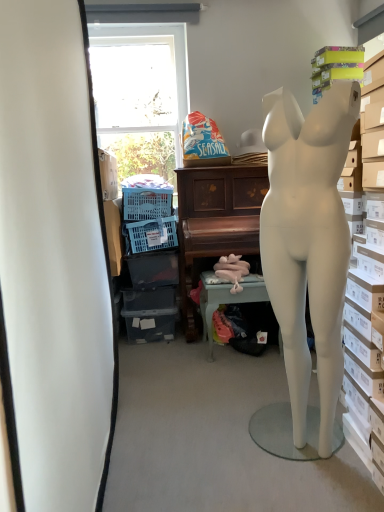
Question: Is wooden piano at center wider than pink fabric-covered table at center?

Choices:
 (A) yes
 (B) no

Answer: (A)

Question: Is wooden piano at center thinner than pink fabric-covered table at center?

Choices:
 (A) yes
 (B) no

Answer: (B)

Question: Does wooden piano at center have a lesser height compared to pink fabric-covered table at center?

Choices:
 (A) yes
 (B) no

Answer: (B)

Question: From the image's perspective, would you say wooden piano at center is shown under pink fabric-covered table at center?

Choices:
 (A) no
 (B) yes

Answer: (A)

Question: Is wooden piano at center positioned with its back to pink fabric-covered table at center?

Choices:
 (A) no
 (B) yes

Answer: (A)

Question: From a real-world perspective, is wooden piano at center positioned over pink fabric-covered table at center based on gravity?

Choices:
 (A) no
 (B) yes

Answer: (B)

Question: Does blue plastic laundry basket at lower left come behind pink fabric-covered table at center?

Choices:
 (A) yes
 (B) no

Answer: (A)

Question: Is blue plastic laundry basket at lower left bigger than pink fabric-covered table at center?

Choices:
 (A) yes
 (B) no

Answer: (B)

Question: Is blue plastic laundry basket at lower left taller than pink fabric-covered table at center?

Choices:
 (A) no
 (B) yes

Answer: (A)

Question: From the image's perspective, is blue plastic laundry basket at lower left on top of pink fabric-covered table at center?

Choices:
 (A) yes
 (B) no

Answer: (A)

Question: From a real-world perspective, does blue plastic laundry basket at lower left stand above pink fabric-covered table at center?

Choices:
 (A) yes
 (B) no

Answer: (A)

Question: Is blue plastic laundry basket at lower left positioned with its back to pink fabric-covered table at center?

Choices:
 (A) no
 (B) yes

Answer: (A)

Question: Is blue plastic laundry basket at lower left in front of wooden piano at center?

Choices:
 (A) yes
 (B) no

Answer: (B)